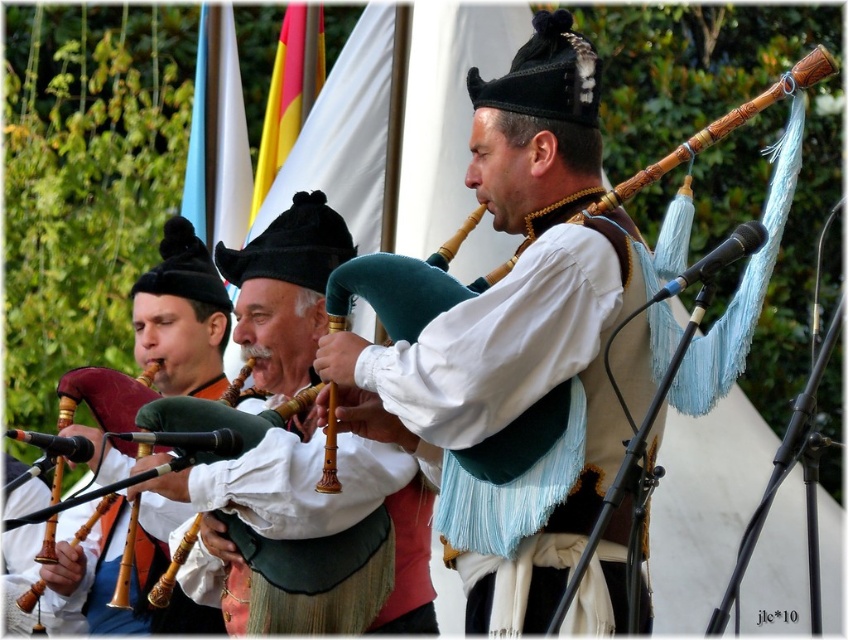
Between matte brown bagpipes at center and wooden bagpipes at center, which one is positioned higher?

matte brown bagpipes at center is above.

Which is more to the left, matte brown bagpipes at center or wooden bagpipes at center?

wooden bagpipes at center is more to the left.

Locate an element on the screen. The height and width of the screenshot is (640, 848). matte brown bagpipes at center is located at coordinates (516, 312).

This screenshot has height=640, width=848. In order to click on matte brown bagpipes at center in this screenshot , I will do `click(516, 312)`.

Which is behind, point (112, 528) or point (52, 502)?

The point (112, 528) is behind.

Who is higher up, matte black bagpipe at left or wooden pipes at left?

matte black bagpipe at left is above.

Which is in front, point (192, 228) or point (74, 404)?

Point (74, 404) is in front.

I want to click on matte black bagpipe at left, so click(x=182, y=316).

Does matte brown bagpipes at center lie in front of wooden pipes at left?

That is True.

Image resolution: width=848 pixels, height=640 pixels. Describe the element at coordinates (516, 312) in the screenshot. I see `matte brown bagpipes at center` at that location.

Who is more distant from viewer, (527, 140) or (109, 500)?

Positioned behind is point (109, 500).

Identify the location of matte brown bagpipes at center. (516, 312).